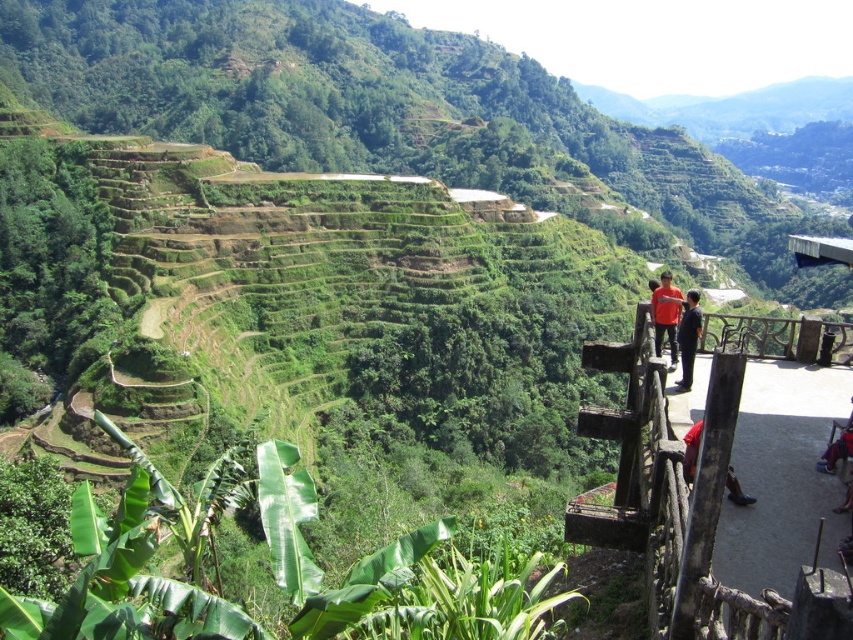
Does orange shirt at center have a smaller size compared to dark blue jeans at lower right?

No.

Identify the location of orange shirt at center. click(x=666, y=316).

Which of these two, orange shirt at center or black smooth shirt at upper center, stands shorter?

Standing shorter between the two is orange shirt at center.

Does orange shirt at center have a greater height compared to black smooth shirt at upper center?

In fact, orange shirt at center may be shorter than black smooth shirt at upper center.

Who is more distant from viewer, (672,307) or (688,320)?

The point (672,307) is more distant.

Find the location of a particular element. The width and height of the screenshot is (853, 640). orange shirt at center is located at coordinates (666, 316).

Is orange shirt at center taller than red matte pants at lower right?

Yes, orange shirt at center is taller than red matte pants at lower right.

Does point (660, 332) lie behind point (688, 468)?

Yes, point (660, 332) is behind point (688, 468).

Locate an element on the screen. orange shirt at center is located at coordinates (666, 316).